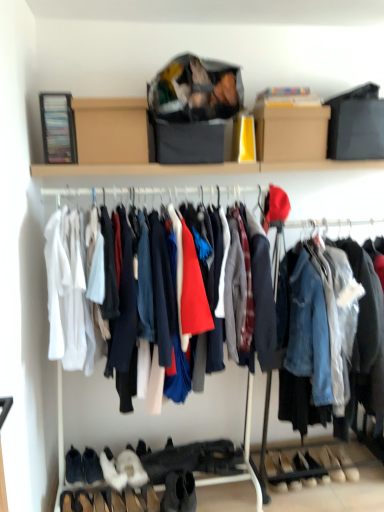
Question: From the image's perspective, is black suede boot at lower left, the 1th footwear in the left-to-right sequence, under white suede boot at lower left, which is counted as the seventh footwear, starting from the right?

Choices:
 (A) yes
 (B) no

Answer: (B)

Question: Does black suede boot at lower left, which appears as the 8th footwear when viewed from the right, lie behind white suede boot at lower left, which is the second footwear in left-to-right order?

Choices:
 (A) no
 (B) yes

Answer: (B)

Question: Does black suede boot at lower left, the 1th footwear in the left-to-right sequence, appear on the left side of white suede boot at lower left, which is counted as the seventh footwear, starting from the right?

Choices:
 (A) yes
 (B) no

Answer: (A)

Question: From a real-world perspective, is black suede boot at lower left, which appears as the 8th footwear when viewed from the right, located higher than white suede boot at lower left, which is the second footwear in left-to-right order?

Choices:
 (A) no
 (B) yes

Answer: (B)

Question: Is black suede boot at lower left, which appears as the 8th footwear when viewed from the right, oriented away from white suede boot at lower left, which is the second footwear in left-to-right order?

Choices:
 (A) no
 (B) yes

Answer: (A)

Question: Is leather beige shoe at lower center, the 1th shoe in the left-to-right sequence, inside or outside of white suede shoe at lower right, which ranks as the first footwear in right-to-left order?

Choices:
 (A) inside
 (B) outside

Answer: (B)

Question: Considering the positions of leather beige shoe at lower center, the 1th shoe in the left-to-right sequence, and white suede shoe at lower right, which is the eighth footwear in left-to-right order, in the image, is leather beige shoe at lower center, the 1th shoe in the left-to-right sequence, bigger or smaller than white suede shoe at lower right, which is the eighth footwear in left-to-right order,?

Choices:
 (A) small
 (B) big

Answer: (B)

Question: Considering the positions of point (276, 453) and point (342, 465), is point (276, 453) closer or farther from the camera than point (342, 465)?

Choices:
 (A) closer
 (B) farther

Answer: (B)

Question: Considering their positions, is leather beige shoe at lower center, the 1th shoe in the left-to-right sequence, located in front of or behind white suede shoe at lower right, which ranks as the first footwear in right-to-left order?

Choices:
 (A) front
 (B) behind

Answer: (A)

Question: Does point (145, 480) appear closer or farther from the camera than point (182, 507)?

Choices:
 (A) closer
 (B) farther

Answer: (A)

Question: From a real-world perspective, relative to black suede boot at lower center, which is the 5th footwear from right to left, is white suede sneakers at lower center, which is counted as the sixth footwear, starting from the right, vertically above or below?

Choices:
 (A) above
 (B) below

Answer: (A)

Question: Considering their positions, is white suede sneakers at lower center, which is counted as the sixth footwear, starting from the right, located in front of or behind black suede boot at lower center, which is the 5th footwear from right to left?

Choices:
 (A) front
 (B) behind

Answer: (B)

Question: In terms of width, does white suede sneakers at lower center, which is counted as the sixth footwear, starting from the right, look wider or thinner when compared to black suede boot at lower center, which is the 5th footwear from right to left?

Choices:
 (A) thin
 (B) wide

Answer: (B)

Question: Considering the relative positions of leather shoe at lower center, which is counted as the first shoe, starting from the right, and white suede shoes at lower center, arranged as the sixth footwear when viewed from the left, in the image provided, is leather shoe at lower center, which is counted as the first shoe, starting from the right, to the left or to the right of white suede shoes at lower center, arranged as the sixth footwear when viewed from the left,?

Choices:
 (A) right
 (B) left

Answer: (A)

Question: Relative to white suede shoes at lower center, placed as the 3th footwear when sorted from right to left, is leather shoe at lower center, which is counted as the first shoe, starting from the right, in front or behind?

Choices:
 (A) front
 (B) behind

Answer: (B)